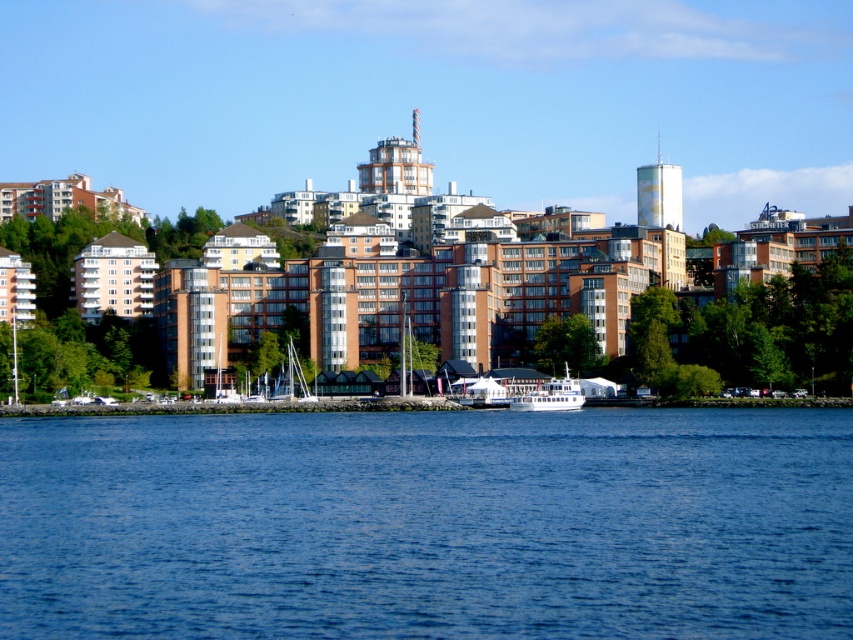
Does white glossy ferry at center appear on the right side of white matte sailboat at center?

Indeed, white glossy ferry at center is positioned on the right side of white matte sailboat at center.

Does white glossy ferry at center appear over white matte sailboat at center?

Correct, white glossy ferry at center is located above white matte sailboat at center.

Locate an element on the screen. white glossy ferry at center is located at coordinates (550, 396).

Is blue liquid water at center wider than white glossy ferry at center?

Yes.

Can you confirm if blue liquid water at center is bigger than white glossy ferry at center?

Yes.

Who is more forward, [556,572] or [578,397]?

Point [556,572] is in front.

At what (x,y) coordinates should I click in order to perform the action: click on blue liquid water at center. Please return your answer as a coordinate pair (x, y). Looking at the image, I should click on (428, 524).

Who is shorter, blue liquid water at center or white matte sailboat at center?

white matte sailboat at center

Does blue liquid water at center come in front of white matte sailboat at center?

Yes, it is.

Between point (160, 456) and point (508, 404), which one is positioned in front?

Point (160, 456)

Where is `blue liquid water at center`? The height and width of the screenshot is (640, 853). blue liquid water at center is located at coordinates (428, 524).